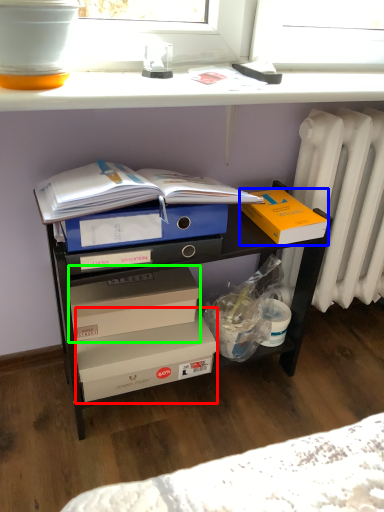
Question: Estimate the real-world distances between objects in this image. Which object is closer to box (highlighted by a red box), box (highlighted by a blue box) or box (highlighted by a green box)?

Choices:
 (A) box
 (B) box

Answer: (B)